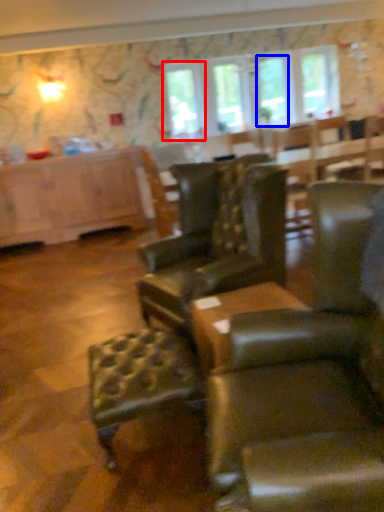
Question: Which point is further to the camera, window screen (highlighted by a red box) or window screen (highlighted by a blue box)?

Choices:
 (A) window screen
 (B) window screen

Answer: (B)